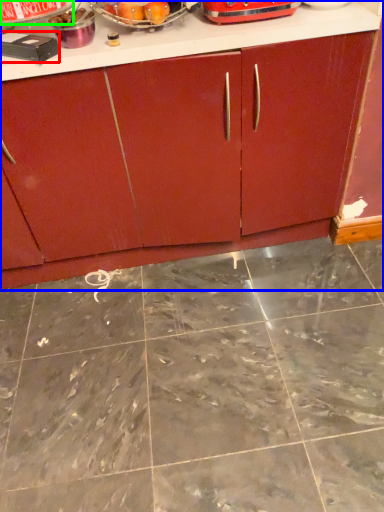
Question: Based on their relative distances, which object is farther from appliance (highlighted by a red box)? Choose from cabinetry (highlighted by a blue box) and appliance (highlighted by a green box).

Choices:
 (A) cabinetry
 (B) appliance

Answer: (A)